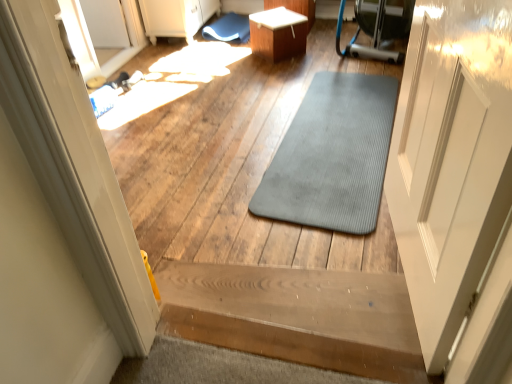
Question: Is gray rubber mat at center thinner than white glossy table at upper center?

Choices:
 (A) yes
 (B) no

Answer: (B)

Question: From a real-world perspective, does gray rubber mat at center sit lower than white glossy table at upper center?

Choices:
 (A) yes
 (B) no

Answer: (A)

Question: Is gray rubber mat at center turned away from white glossy table at upper center?

Choices:
 (A) yes
 (B) no

Answer: (B)

Question: Would you say gray rubber mat at center is outside white glossy table at upper center?

Choices:
 (A) no
 (B) yes

Answer: (B)

Question: Does gray rubber mat at center have a lesser height compared to white glossy table at upper center?

Choices:
 (A) no
 (B) yes

Answer: (B)

Question: Can you confirm if gray rubber mat at center is positioned to the right of white glossy table at upper center?

Choices:
 (A) no
 (B) yes

Answer: (B)

Question: Does blue rubber bath mat at upper center lie behind gray rubber mat at center?

Choices:
 (A) no
 (B) yes

Answer: (B)

Question: Can you confirm if blue rubber bath mat at upper center is thinner than gray rubber mat at center?

Choices:
 (A) no
 (B) yes

Answer: (B)

Question: From a real-world perspective, is blue rubber bath mat at upper center beneath gray rubber mat at center?

Choices:
 (A) no
 (B) yes

Answer: (A)

Question: Could you tell me if blue rubber bath mat at upper center is facing gray rubber mat at center?

Choices:
 (A) no
 (B) yes

Answer: (A)

Question: Can you confirm if blue rubber bath mat at upper center is positioned to the right of gray rubber mat at center?

Choices:
 (A) no
 (B) yes

Answer: (A)

Question: Does blue rubber bath mat at upper center appear on the left side of gray rubber mat at center?

Choices:
 (A) no
 (B) yes

Answer: (B)

Question: Is transparent glass door at upper left looking in the opposite direction of wooden stairs at center?

Choices:
 (A) yes
 (B) no

Answer: (B)